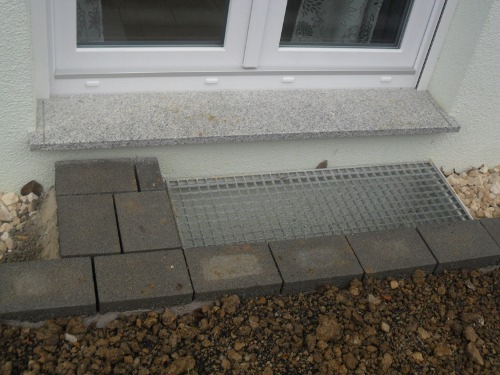
Identify the location of bumps on window sill. The height and width of the screenshot is (375, 500). (93, 86), (209, 82), (290, 79), (390, 80).